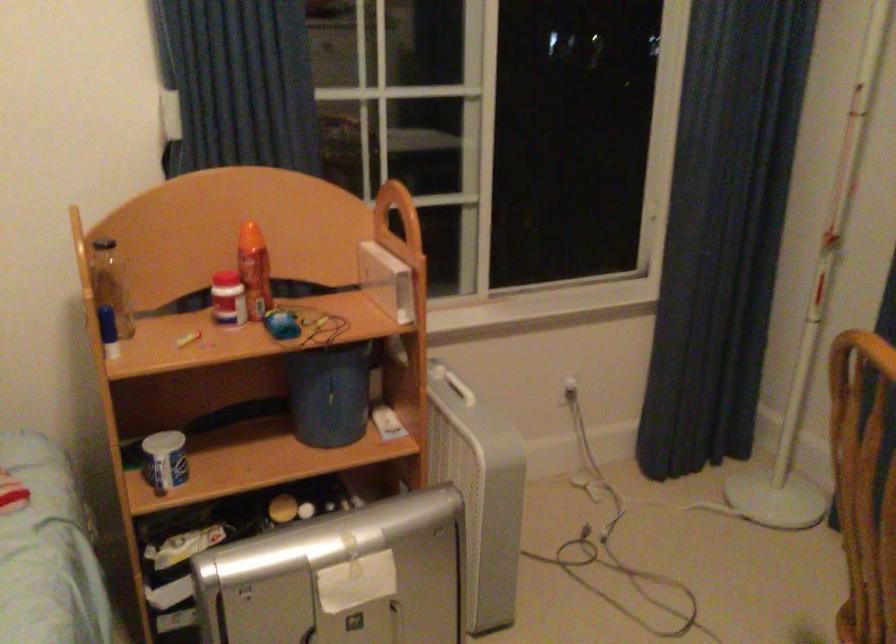
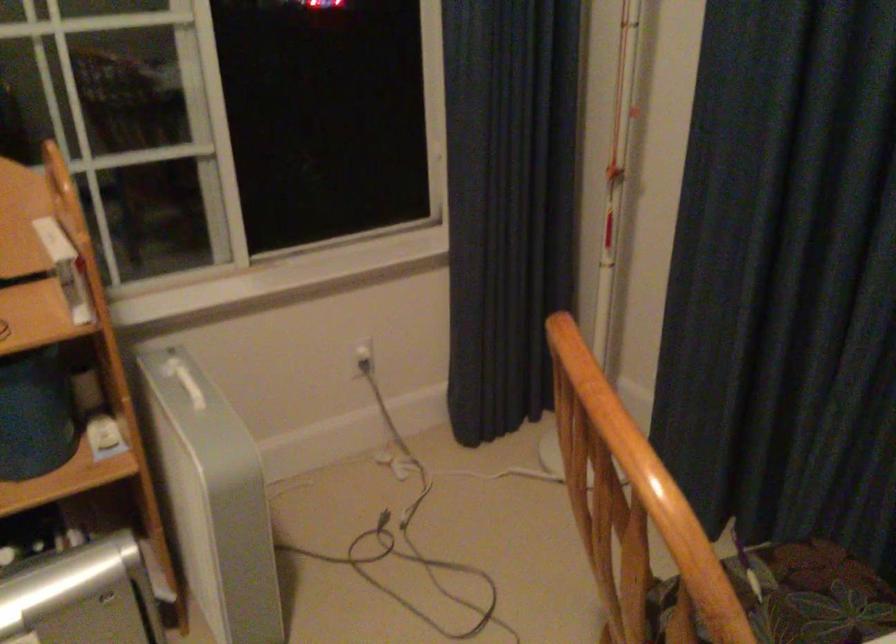
The images are taken continuously from a first-person perspective. In which direction are you moving?

The cameraman walked toward right, forward.